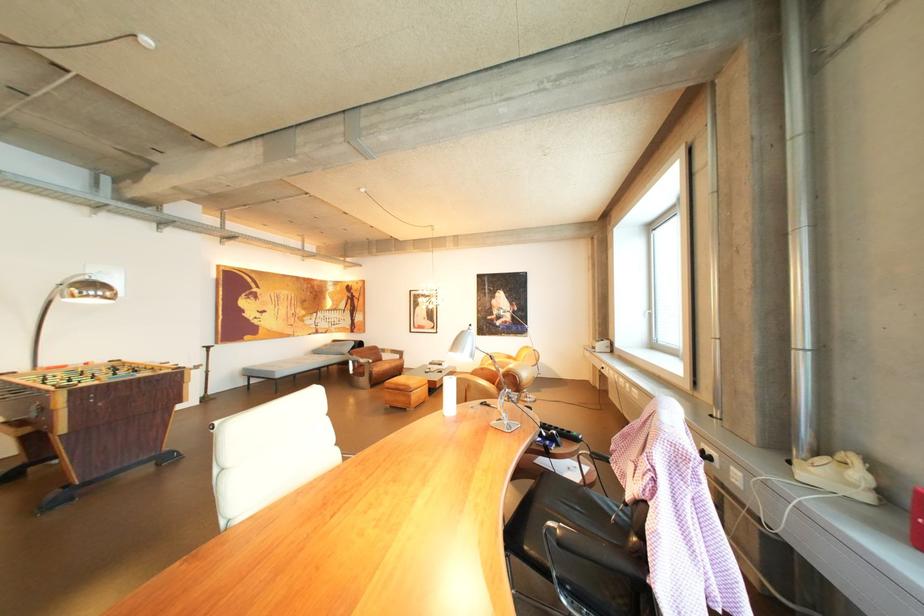
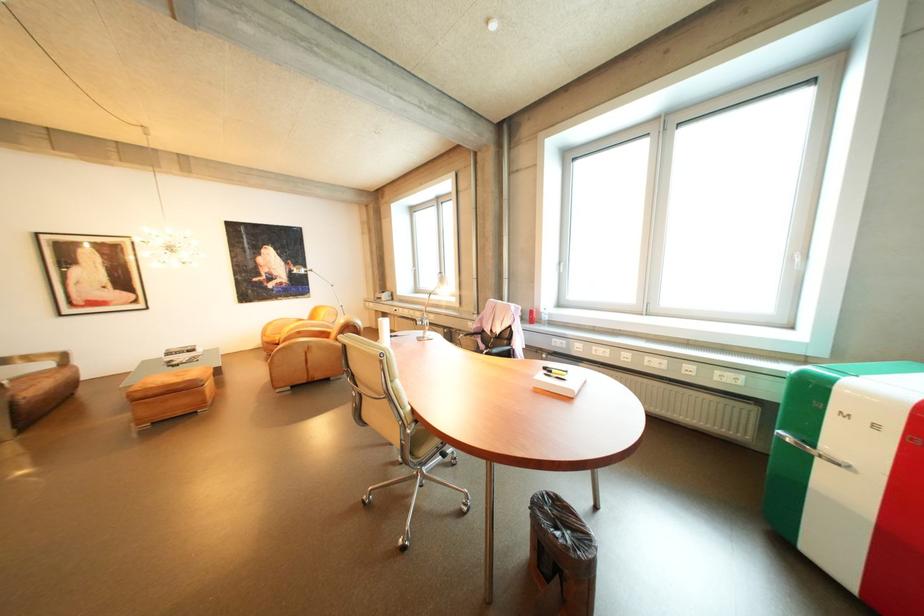
Question: I am providing you with two images of the same scene from different viewpoints. Which of the following objects are not visible in image2?

Choices:
 (A) black marker
 (B) chair sitting surface
 (C) small trash can
 (D) none of these

Answer: (D)